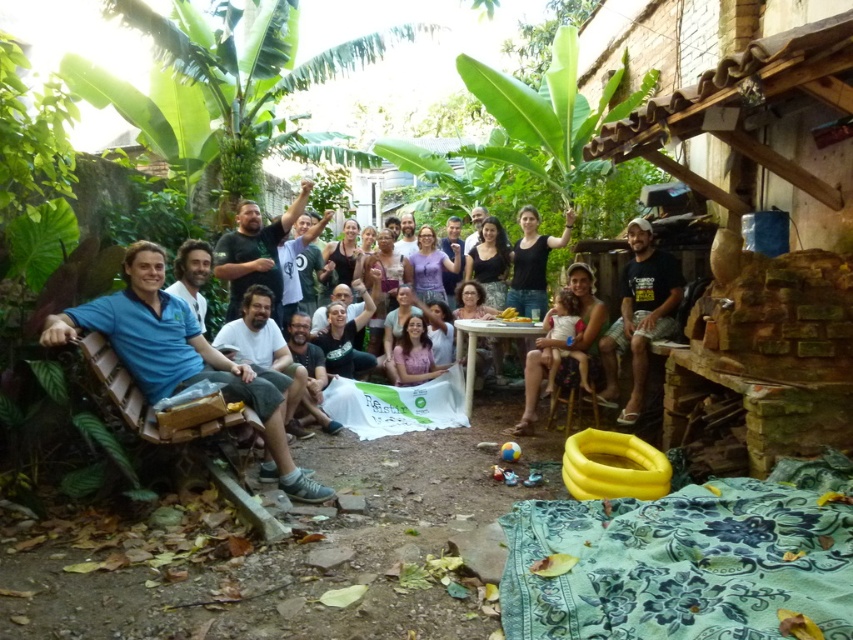
Between blue fabric bench at left and black cotton t-shirt at right, which one has more height?

With more height is black cotton t-shirt at right.

What do you see at coordinates (181, 356) in the screenshot?
I see `blue fabric bench at left` at bounding box center [181, 356].

Is point (100, 310) farther from camera compared to point (602, 356)?

No.

Where is `blue fabric bench at left`? This screenshot has height=640, width=853. blue fabric bench at left is located at coordinates (181, 356).